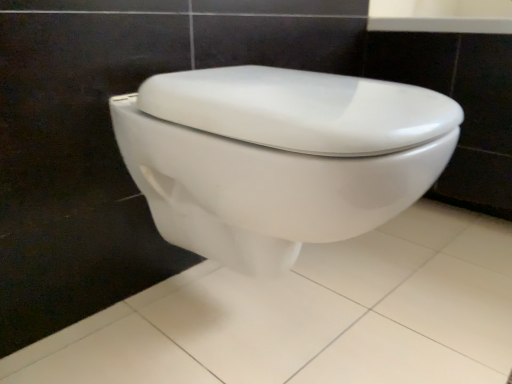
Question: Is white glossy toilet at center looking in the opposite direction of white glossy toilet at center?

Choices:
 (A) no
 (B) yes

Answer: (A)

Question: Can you confirm if white glossy toilet at center is taller than white glossy toilet at center?

Choices:
 (A) yes
 (B) no

Answer: (A)

Question: Considering the relative sizes of white glossy toilet at center and white glossy toilet at center in the image provided, is white glossy toilet at center shorter than white glossy toilet at center?

Choices:
 (A) yes
 (B) no

Answer: (B)

Question: Can you confirm if white glossy toilet at center is positioned to the right of white glossy toilet at center?

Choices:
 (A) no
 (B) yes

Answer: (A)

Question: Considering the relative sizes of white glossy toilet at center and white glossy toilet at center in the image provided, is white glossy toilet at center smaller than white glossy toilet at center?

Choices:
 (A) no
 (B) yes

Answer: (A)

Question: Would you say white glossy toilet at center is a long distance from white glossy toilet at center?

Choices:
 (A) no
 (B) yes

Answer: (A)

Question: Is white glossy toilet at center outside white glossy toilet at center?

Choices:
 (A) yes
 (B) no

Answer: (A)

Question: Does white glossy toilet at center have a greater height compared to white glossy toilet at center?

Choices:
 (A) yes
 (B) no

Answer: (B)

Question: Does white glossy toilet at center have a larger size compared to white glossy toilet at center?

Choices:
 (A) no
 (B) yes

Answer: (A)

Question: Does white glossy toilet at center turn towards white glossy toilet at center?

Choices:
 (A) yes
 (B) no

Answer: (B)

Question: Is white glossy toilet at center facing away from white glossy toilet at center?

Choices:
 (A) no
 (B) yes

Answer: (A)

Question: Can you confirm if white glossy toilet at center is shorter than white glossy toilet at center?

Choices:
 (A) yes
 (B) no

Answer: (A)

Question: Is white glossy toilet at center to the left or to the right of white glossy toilet at center in the image?

Choices:
 (A) right
 (B) left

Answer: (A)